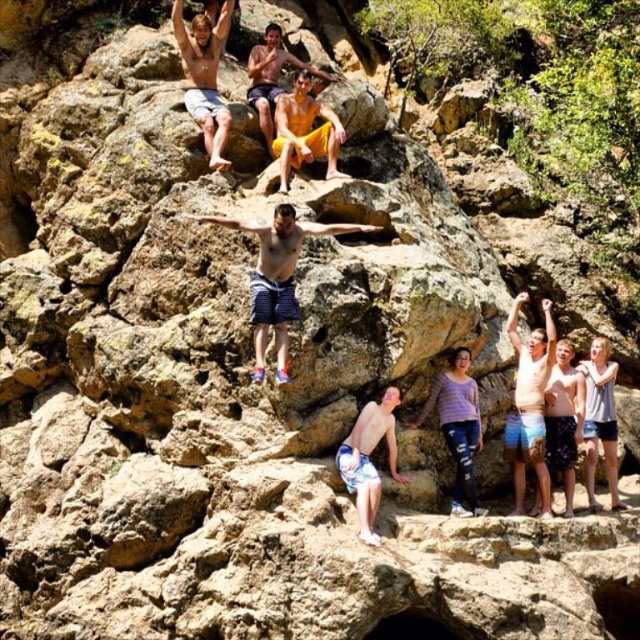
Is point (536, 460) positioned behind point (260, 83)?

No.

Identify the location of matte blue shorts at center. Image resolution: width=640 pixels, height=640 pixels. (529, 403).

Between white striped shorts at center and yellow shorts at upper center, which one appears on the left side from the viewer's perspective?

yellow shorts at upper center

Is white striped shorts at center above yellow shorts at upper center?

No, white striped shorts at center is not above yellow shorts at upper center.

Between point (353, 436) and point (278, 45), which one is positioned in front?

Point (353, 436)

Where is `white striped shorts at center`? The width and height of the screenshot is (640, 640). white striped shorts at center is located at coordinates (369, 458).

Which is more to the right, matte skin at upper left or yellow shorts at upper center?

yellow shorts at upper center is more to the right.

Does matte skin at upper left appear on the left side of yellow shorts at upper center?

Indeed, matte skin at upper left is positioned on the left side of yellow shorts at upper center.

Measure the distance between point (216,64) and camera.

Point (216,64) is 65.82 meters away from camera.

Where is `matte skin at upper left`? This screenshot has height=640, width=640. matte skin at upper left is located at coordinates (204, 76).